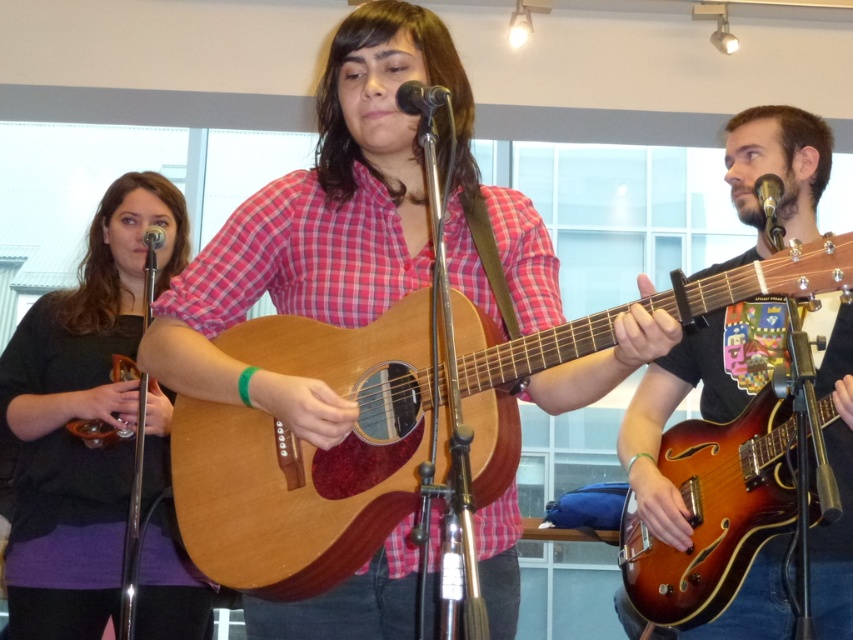
Question: Which is farther from the black matte microphone at center?

Choices:
 (A) metallic silver microphone at upper left
 (B) metallic gold microphone at upper right
 (C) shiny brown guitar at right

Answer: (A)

Question: Is shiny brown guitar at right smaller than black matte microphone at center?

Choices:
 (A) no
 (B) yes

Answer: (A)

Question: Does matte wood guitar at center appear on the left side of black matte microphone at center?

Choices:
 (A) yes
 (B) no

Answer: (A)

Question: Is matte wood guitar at center in front of shiny brown guitar at right?

Choices:
 (A) yes
 (B) no

Answer: (A)

Question: Among these objects, which one is farthest from the camera?

Choices:
 (A) matte black sweater at left
 (B) metallic silver microphone at upper left
 (C) matte wood guitar at center
 (D) metallic gold microphone at upper right

Answer: (B)

Question: Which point is farther to the camera?

Choices:
 (A) (782, 236)
 (B) (398, 100)
 (C) (331, 54)
 (D) (701, 339)

Answer: (D)